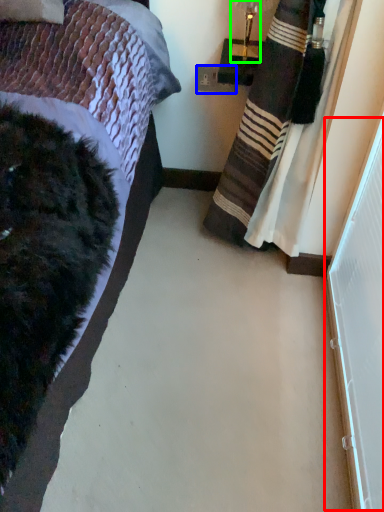
Question: Estimate the real-world distances between objects in this image. Which object is closer to screen door (highlighted by a red box), power outlet (highlighted by a blue box) or lamp (highlighted by a green box)?

Choices:
 (A) power outlet
 (B) lamp

Answer: (B)